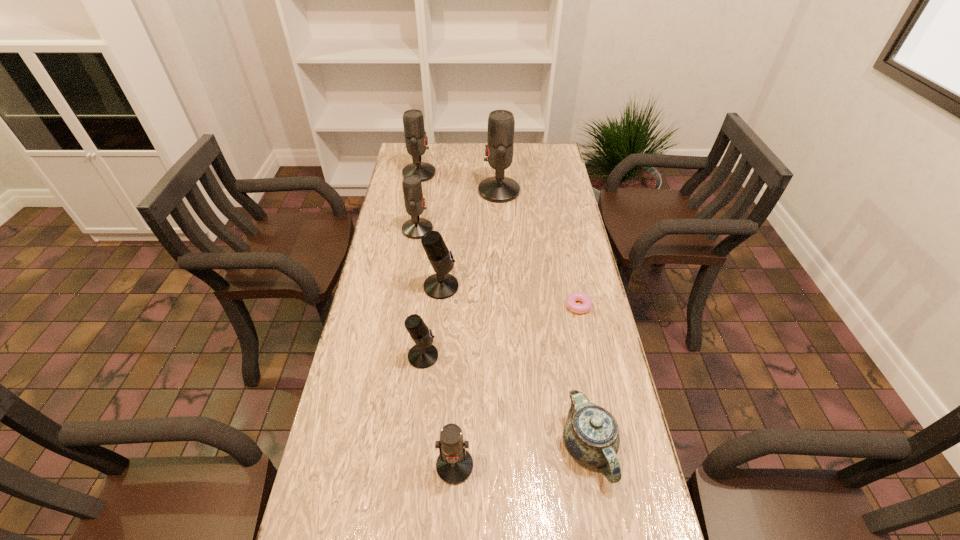
I want to click on free point at the right edge, so click(552, 199).

Locate an element on the screen. This screenshot has width=960, height=540. free space at the far left corner of the desktop is located at coordinates tap(402, 148).

This screenshot has height=540, width=960. Identify the location of vacant area at the far right corner. (527, 171).

Where is `unoccupied position between the chinaware and the biggest red microphone`? unoccupied position between the chinaware and the biggest red microphone is located at coordinates (543, 319).

Locate an element on the screen. The image size is (960, 540). free spot between the chinaware and the farther black microphone is located at coordinates (515, 367).

The width and height of the screenshot is (960, 540). Find the location of `free space between the third biggest red microphone and the third object from right to left`. free space between the third biggest red microphone and the third object from right to left is located at coordinates (458, 210).

You are a GUI agent. You are given a task and a screenshot of the screen. Output one action in this format:
    pyautogui.click(x=<x>, y=<y>)
    Task: Click on the vacant area that lies between the seventh shortest object and the seventh tallest object
    
    Given the screenshot: What is the action you would take?
    pyautogui.click(x=504, y=310)

Locate an element on the screen. Image resolution: width=960 pixels, height=540 pixels. free space between the nearest microphone and the sixth nearest object is located at coordinates (436, 348).

At what (x,y) coordinates should I click in order to perform the action: click on vacant region between the third red microphone from left to right and the second nearest red microphone. Please return your answer as a coordinate pair (x, y). This screenshot has height=540, width=960. Looking at the image, I should click on (436, 348).

Locate an element on the screen. The width and height of the screenshot is (960, 540). vacant area that lies between the nearest microphone and the third farthest red microphone is located at coordinates (436, 348).